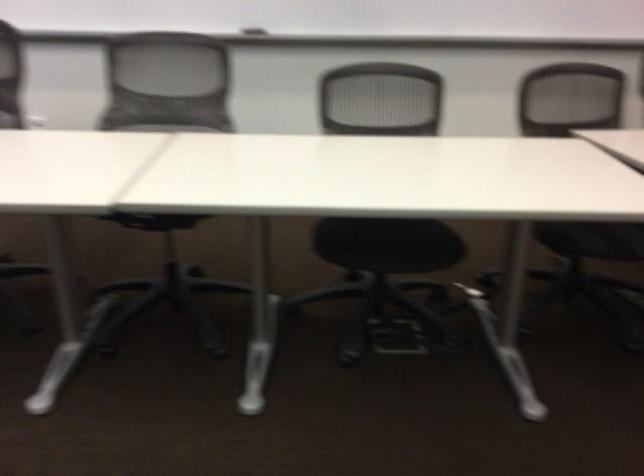
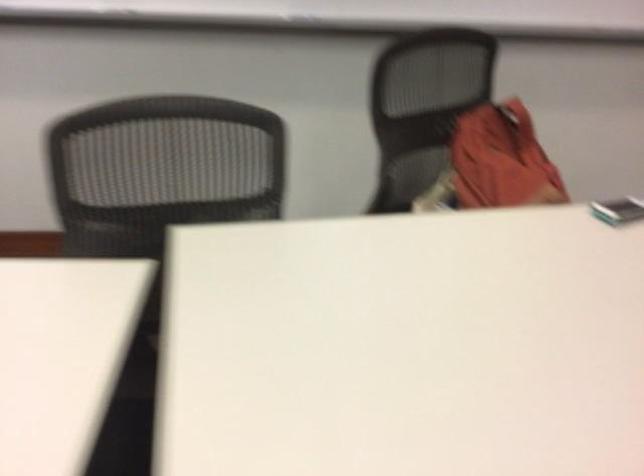
Consider the image. In a continuous first-person perspective shot, in which direction is the camera moving?

The cameraman walked toward right, forward.